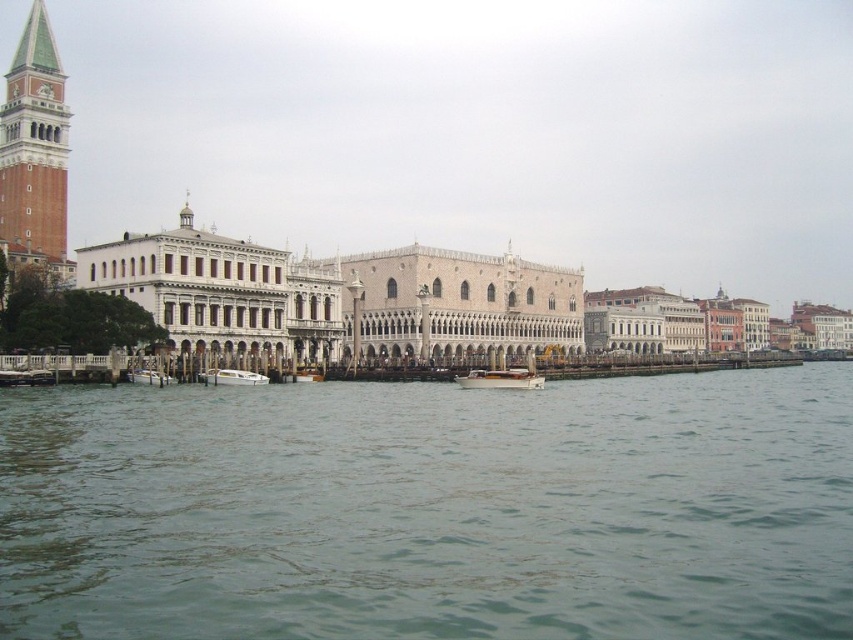
You are a tourist in Venice, and you want to take a boat ride. You see a wooden polished boat at center and a white matte boat at lower left. Which boat is taller?

The wooden polished boat at center is taller than the white matte boat at lower left.

You are an architect visiting Venice and want to take a photo of the golden mosaic palace at center and the white glossy boat at center. Which object should you focus on first if you want to capture both in a single frame without moving the camera?

The golden mosaic palace at center is larger in size than the white glossy boat at center, so you should focus on the golden mosaic palace at center first to ensure it fits properly in the frame before adjusting for the smaller boat.